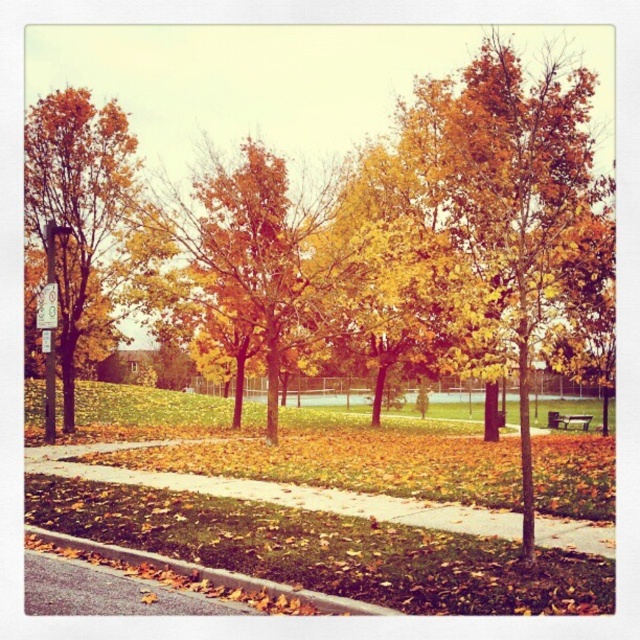
You are a person walking along the gray asphalt pavement at lower left and want to sit on the wooden park bench at center. Which direction should you walk to reach the bench?

The gray asphalt pavement at lower left is in front of wooden park bench at center, so you should walk forward along the gray asphalt pavement at lower left to reach the wooden park bench at center.

You are a gardener trying to clear the golden yellow leaves at left and the gray asphalt pavement at lower left. Which object is located to the left of the other?

The golden yellow leaves at left is positioned on the left side of gray asphalt pavement at lower left, so the golden yellow leaves at left is to the left of the gray asphalt pavement at lower left.

In the scene shown: You are standing at the center of the image and want to walk to the gray asphalt pavement at lower left. According to the coordinates provided, in which direction should you move relative to your current position?

The gray asphalt pavement at lower left is located at coordinates point (106,593), so you should move towards the lower left direction from your current position at the center.